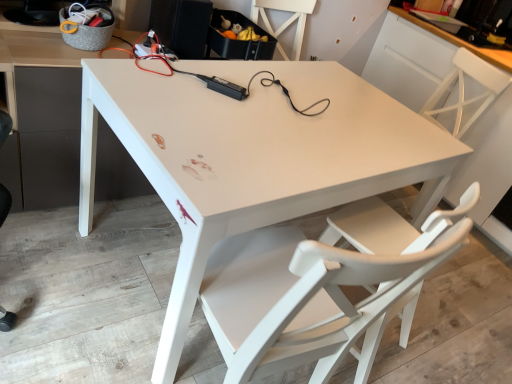
This screenshot has width=512, height=384. Identify the location of vacant area that is situated to the right of white matte chair at lower right, which ranks as the second chair in back-to-front order. (435, 341).